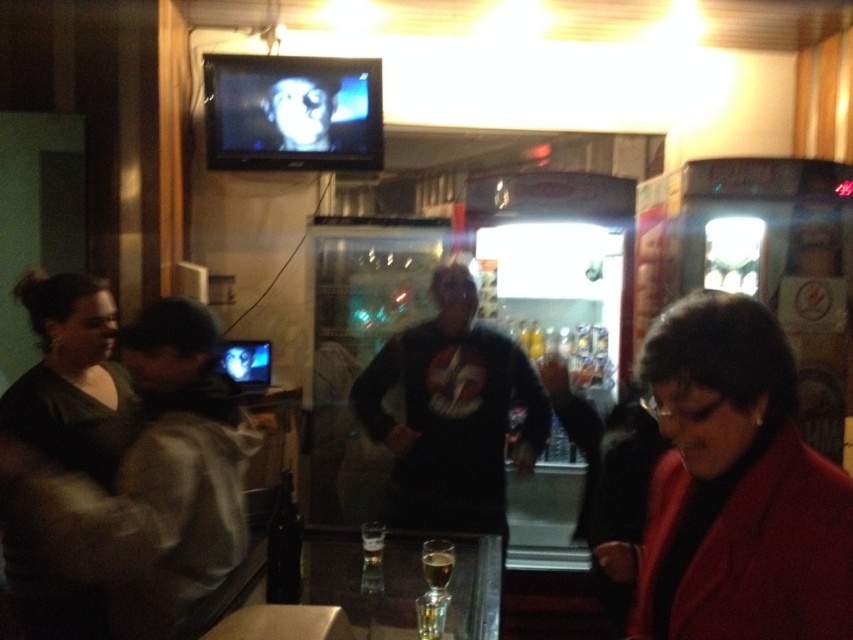
Question: Which of the following is the farthest from the observer?

Choices:
 (A) black matte sweatshirt at center
 (B) matte red coat at lower right
 (C) matte black shirt at left
 (D) translucent glass beer at center

Answer: (A)

Question: Can you confirm if black matte sweatshirt at center is positioned to the right of translucent glass beer at center?

Choices:
 (A) yes
 (B) no

Answer: (A)

Question: Which object is the closest to the matte red coat at lower right?

Choices:
 (A) black matte sweatshirt at center
 (B) translucent glass beer at center
 (C) matte black shirt at left

Answer: (B)

Question: Which point is closer to the camera?

Choices:
 (A) matte red coat at lower right
 (B) translucent glass beer at center
 (C) matte black shirt at left

Answer: (A)

Question: Does matte red coat at lower right appear on the right side of black matte sweatshirt at center?

Choices:
 (A) no
 (B) yes

Answer: (B)

Question: Does matte black shirt at left lie in front of translucent glass beer at center?

Choices:
 (A) no
 (B) yes

Answer: (B)